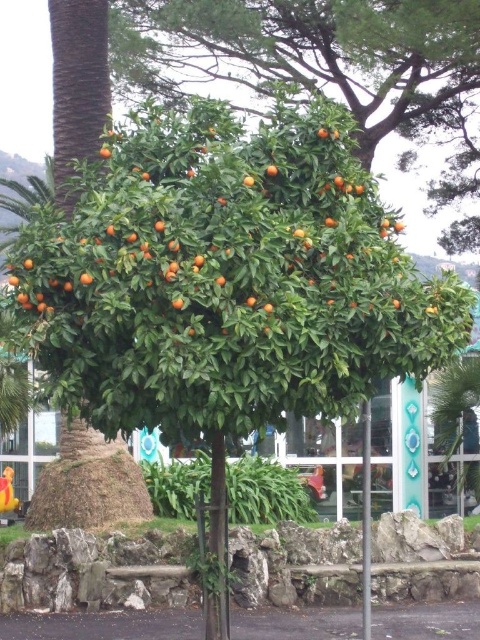
Which of these two, green leafy tree at center or green leafy palm tree at center, stands shorter?

With less height is green leafy palm tree at center.

Can you confirm if green leafy tree at center is wider than green leafy palm tree at center?

Yes, green leafy tree at center is wider than green leafy palm tree at center.

Between point (168, 76) and point (448, 396), which one is positioned in front?

Point (448, 396) is in front.

In order to click on green leafy tree at center in this screenshot , I will do `click(310, 54)`.

Does green leafy palm tree at center have a greater height compared to metallic pole at center?

Yes.

Who is higher up, green leafy palm tree at center or metallic pole at center?

green leafy palm tree at center

Image resolution: width=480 pixels, height=640 pixels. Find the location of `green leafy palm tree at center`. green leafy palm tree at center is located at coordinates (456, 406).

Locate an element on the screen. This screenshot has width=480, height=640. green leafy palm tree at center is located at coordinates 456,406.

Is green leafy tree at center below metallic pole at center?

Actually, green leafy tree at center is above metallic pole at center.

Which is behind, point (424, 20) or point (363, 433)?

Positioned behind is point (424, 20).

This screenshot has width=480, height=640. In order to click on green leafy tree at center in this screenshot , I will do `click(310, 54)`.